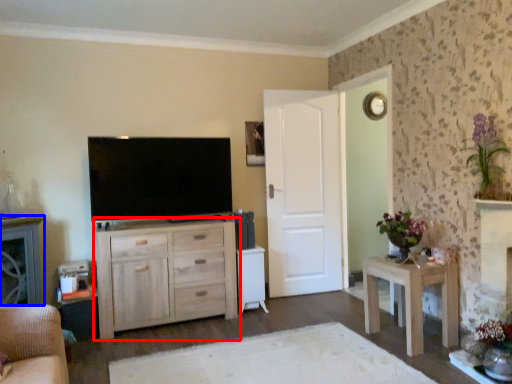
Question: Which object is closer to the camera taking this photo, chest of drawers (highlighted by a red box) or cabinetry (highlighted by a blue box)?

Choices:
 (A) chest of drawers
 (B) cabinetry

Answer: (B)